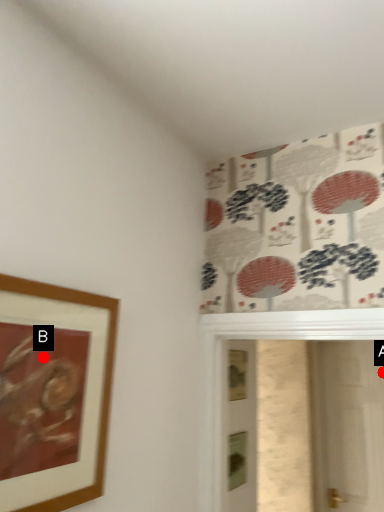
Question: Two points are circled on the image, labeled by A and B beside each circle. Among these points, which one is nearest to the camera?

Choices:
 (A) A is closer
 (B) B is closer

Answer: (B)